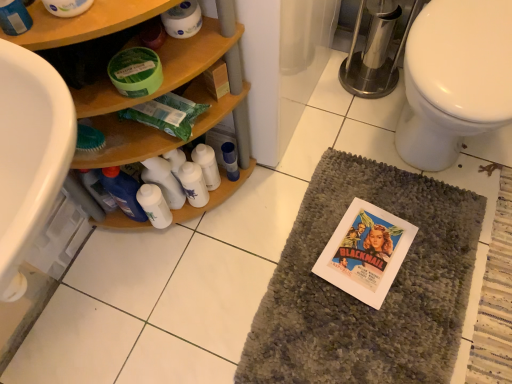
The image size is (512, 384). What are the coordinates of `vacant area situated to the left side of white matte lotion at center, marked as the 2th toiletry in a right-to-left arrangement` in the screenshot? It's located at (115, 249).